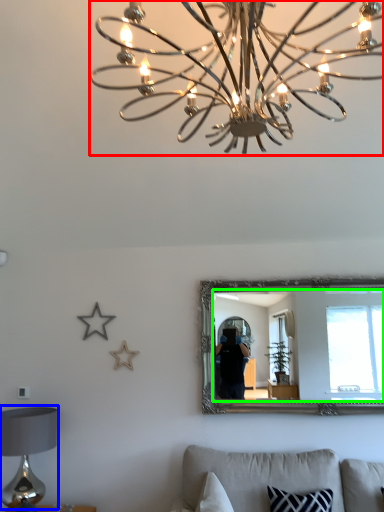
Question: Considering the real-world distances, which object is farthest from lamp (highlighted by a red box)? table lamp (highlighted by a blue box) or mirror (highlighted by a green box)?

Choices:
 (A) table lamp
 (B) mirror

Answer: (B)